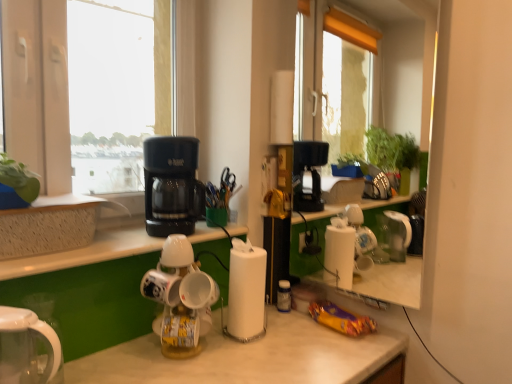
Question: Is green leafy plant at upper left shorter than transparent glass mirror at upper center?

Choices:
 (A) yes
 (B) no

Answer: (A)

Question: Is green leafy plant at upper left aimed at transparent glass mirror at upper center?

Choices:
 (A) no
 (B) yes

Answer: (A)

Question: Is transparent glass mirror at upper center located within green leafy plant at upper left?

Choices:
 (A) no
 (B) yes

Answer: (A)

Question: From a real-world perspective, is green leafy plant at upper left under transparent glass mirror at upper center?

Choices:
 (A) yes
 (B) no

Answer: (A)

Question: Considering the relative sizes of green leafy plant at upper left and transparent glass mirror at upper center in the image provided, is green leafy plant at upper left thinner than transparent glass mirror at upper center?

Choices:
 (A) yes
 (B) no

Answer: (B)

Question: Is green leafy plant at upper left at the left side of transparent glass mirror at upper center?

Choices:
 (A) yes
 (B) no

Answer: (A)

Question: Is white glossy kettle at lower left facing away from black plastic coffee maker at upper left, which is the second kitchen appliance in bottom-to-top order?

Choices:
 (A) yes
 (B) no

Answer: (B)

Question: Does white glossy kettle at lower left have a larger size compared to black plastic coffee maker at upper left, which is the second kitchen appliance in bottom-to-top order?

Choices:
 (A) no
 (B) yes

Answer: (A)

Question: Is white glossy kettle at lower left thinner than black plastic coffee maker at upper left, which is the second kitchen appliance in bottom-to-top order?

Choices:
 (A) yes
 (B) no

Answer: (A)

Question: From a real-world perspective, is white glossy kettle at lower left located beneath black plastic coffee maker at upper left, which appears as the 1th kitchen appliance when viewed from the top?

Choices:
 (A) no
 (B) yes

Answer: (B)

Question: Are white glossy kettle at lower left and black plastic coffee maker at upper left, which is the second kitchen appliance in bottom-to-top order, located far from each other?

Choices:
 (A) no
 (B) yes

Answer: (A)

Question: Can you confirm if white glossy kettle at lower left is shorter than black plastic coffee maker at upper left, which is the second kitchen appliance in bottom-to-top order?

Choices:
 (A) no
 (B) yes

Answer: (B)

Question: Can you confirm if green leafy plant at upper left is positioned to the right of white matte cup at center?

Choices:
 (A) yes
 (B) no

Answer: (B)